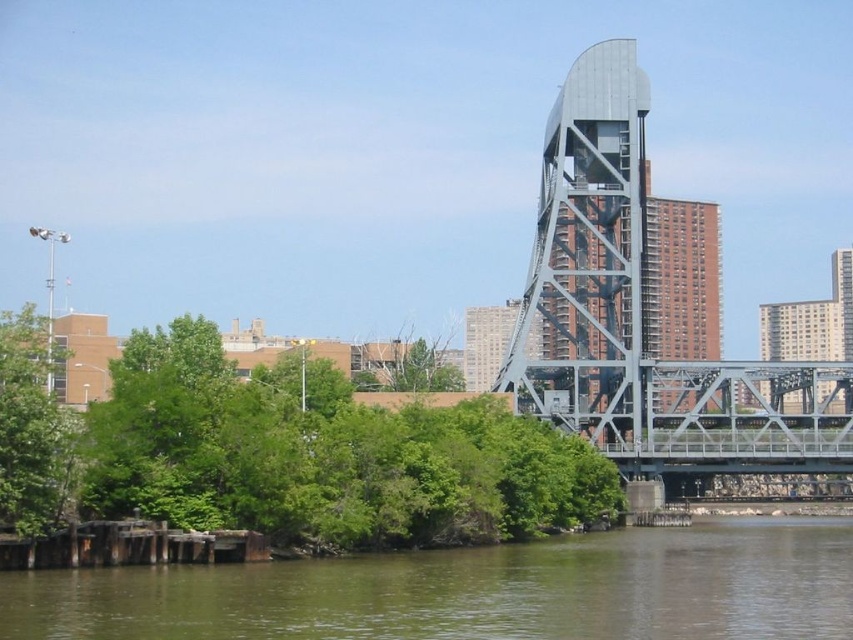
Question: Does green water at lower center have a smaller size compared to green leafy tree at left?

Choices:
 (A) yes
 (B) no

Answer: (A)

Question: Can you confirm if green leafy tree at lower left is bigger than metallic gray bridge at center-right?

Choices:
 (A) no
 (B) yes

Answer: (B)

Question: Does green leafy tree at lower left lie behind green water at lower center?

Choices:
 (A) yes
 (B) no

Answer: (A)

Question: Which object is farther from the camera taking this photo?

Choices:
 (A) green leafy tree at lower left
 (B) green leafy tree at left
 (C) green water at lower center
 (D) metallic gray bridge at center-right

Answer: (D)

Question: Which object appears farthest from the camera in this image?

Choices:
 (A) green leafy tree at lower left
 (B) green leafy tree at left
 (C) metallic gray bridge at center-right
 (D) green water at lower center

Answer: (C)

Question: Estimate the real-world distances between objects in this image. Which object is farther from the green water at lower center?

Choices:
 (A) metallic gray bridge at center-right
 (B) green leafy tree at left

Answer: (B)